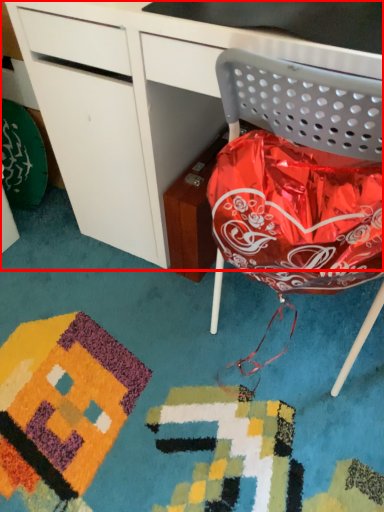
Question: Considering the relative positions of desk (annotated by the red box) and chair in the image provided, where is desk (annotated by the red box) located with respect to the staircase?

Choices:
 (A) right
 (B) left

Answer: (B)